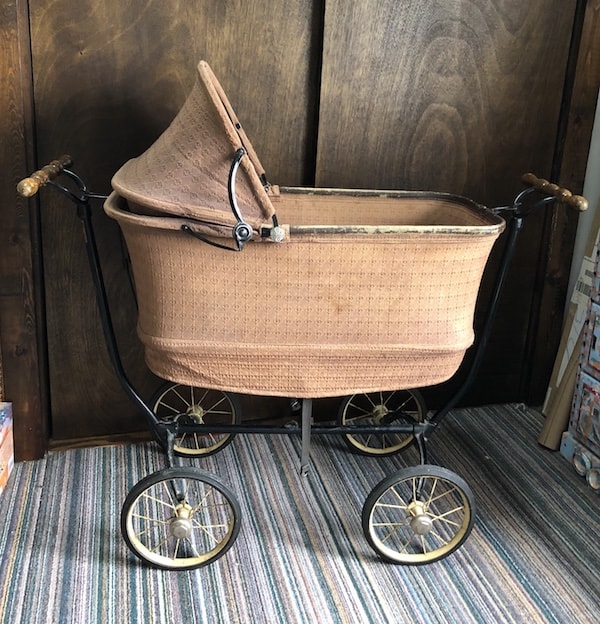
At what (x,y) coordinates should I click in order to perform the action: click on handle. Please return your answer as a coordinate pair (x, y). This screenshot has height=624, width=600. Looking at the image, I should click on (575, 200).